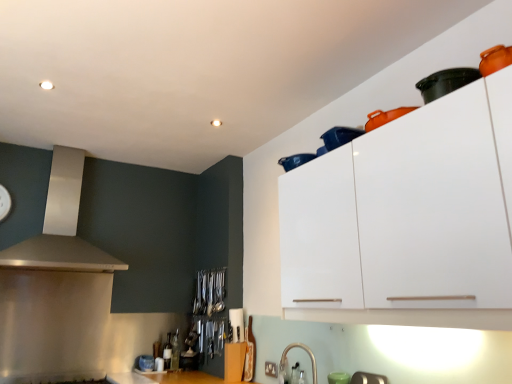
Question: Considering the positions of metallic silver gas stove at lower left and blue plastic container at upper center, marked as the third appliance in a left-to-right arrangement, in the image, is metallic silver gas stove at lower left wider or thinner than blue plastic container at upper center, marked as the third appliance in a left-to-right arrangement,?

Choices:
 (A) wide
 (B) thin

Answer: (A)

Question: Is metallic silver gas stove at lower left bigger or smaller than blue plastic container at upper center, the third appliance ordered from the bottom?

Choices:
 (A) big
 (B) small

Answer: (A)

Question: Considering the real-world distances, which object is closest to the metallic silver gas stove at lower left?

Choices:
 (A) satin silver vent at upper left
 (B) polished stainless steel cutlery at center
 (C) blue plastic container at upper center, which is the first appliance in right-to-left order
 (D) satin nickel faucet at lower center, the second appliance when ordered from right to left
 (E) white plastic knife block at center, the 1th appliance from the left

Answer: (A)

Question: Which object is the closest to the metallic silver gas stove at lower left?

Choices:
 (A) white plastic knife block at center, the 1th appliance from the left
 (B) white glossy cabinet at upper right
 (C) polished stainless steel cutlery at center
 (D) satin silver vent at upper left
 (E) blue plastic container at upper center, marked as the third appliance in a left-to-right arrangement

Answer: (D)